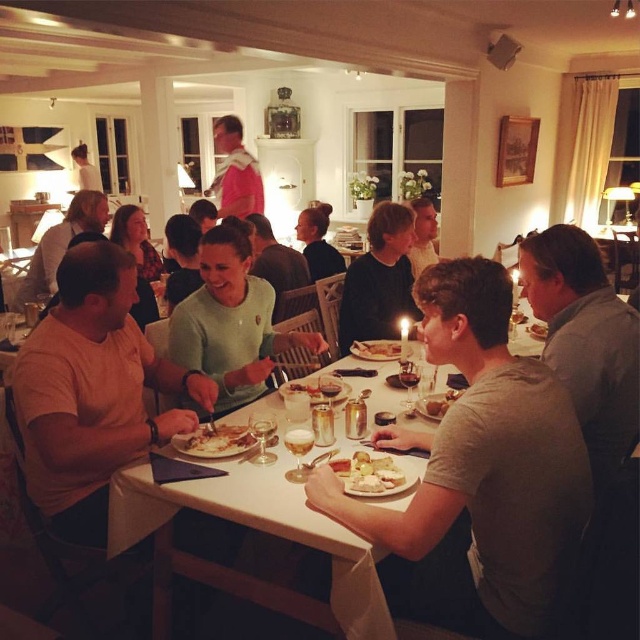
Question: Is green matte sweater at center bigger than smooth wooden plate at center?

Choices:
 (A) no
 (B) yes

Answer: (B)

Question: Which object is positioned closest to the white creamy cheese at center?

Choices:
 (A) light brown wooden chair at left
 (B) pink fabric shirt at upper center
 (C) light brown t-shirt at left

Answer: (C)

Question: Which is farther from the dark green sweater at center?

Choices:
 (A) golden brown bread at center
 (B) white tablecloth at center
 (C) gray cotton shirt at lower right

Answer: (C)

Question: Is green matte sweater at center above white creamy cheese at center?

Choices:
 (A) yes
 (B) no

Answer: (A)

Question: Where is white tablecloth at center located in relation to dark green sweater at center in the image?

Choices:
 (A) above
 (B) below

Answer: (B)

Question: Which point is closer to the camera?

Choices:
 (A) (77, 225)
 (B) (362, 456)
 (C) (260, 516)
 (D) (92, 496)

Answer: (C)